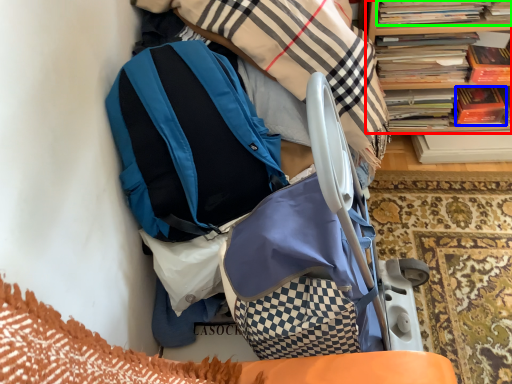
Question: Estimate the real-world distances between objects in this image. Which object is closer to bookcase (highlighted by a red box), paperback book (highlighted by a blue box) or book (highlighted by a green box)?

Choices:
 (A) paperback book
 (B) book

Answer: (B)